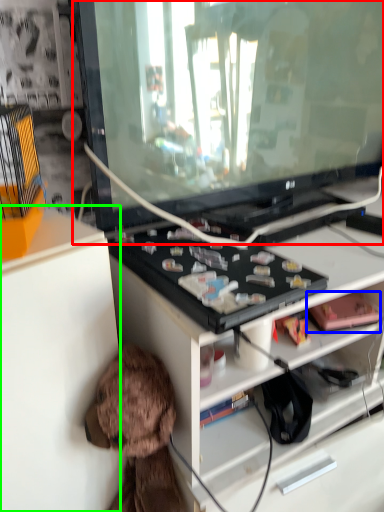
Question: Estimate the real-world distances between objects in this image. Which object is farther from television (highlighted by a red box), toy (highlighted by a blue box) or cabinetry (highlighted by a green box)?

Choices:
 (A) toy
 (B) cabinetry

Answer: (A)